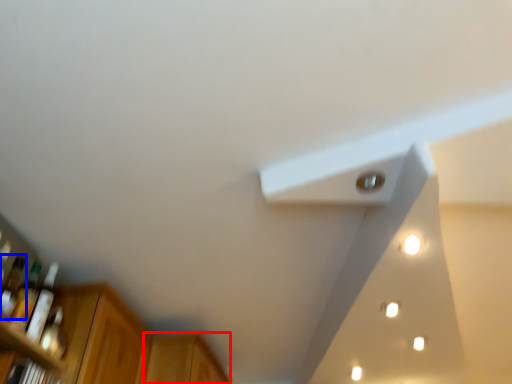
Question: Which point is closer to the camera, cabinetry (highlighted by a red box) or bottle (highlighted by a blue box)?

Choices:
 (A) cabinetry
 (B) bottle

Answer: (B)